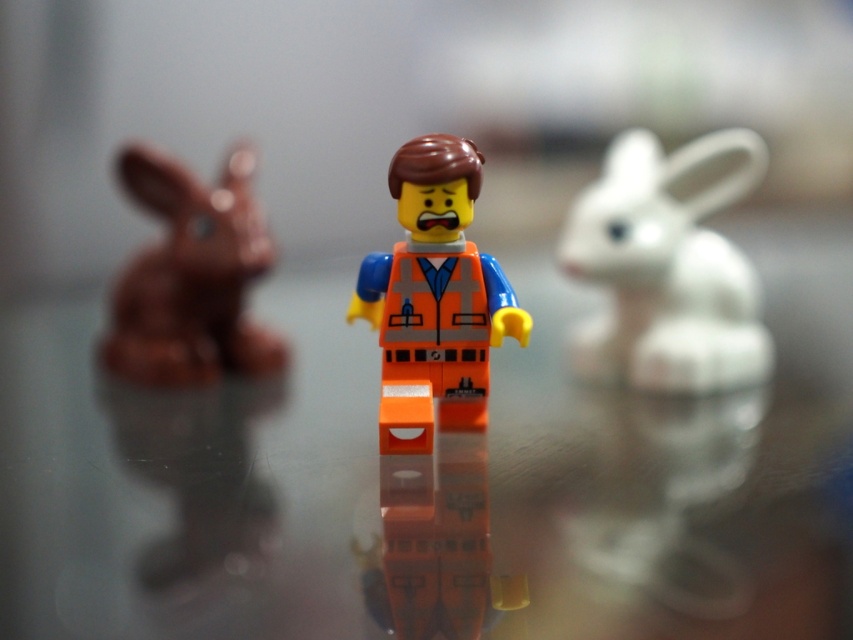
Which is below, white matte rabbit at right or matte brown bunny at left?

matte brown bunny at left is lower down.

Who is higher up, white matte rabbit at right or matte brown bunny at left?

white matte rabbit at right is higher up.

This screenshot has height=640, width=853. Find the location of `white matte rabbit at right`. white matte rabbit at right is located at coordinates (668, 268).

Describe the element at coordinates (434, 298) in the screenshot. I see `orange matte/soft plastic minifigure at center` at that location.

Does orange matte/soft plastic minifigure at center have a lesser width compared to matte brown bunny at left?

Indeed, orange matte/soft plastic minifigure at center has a lesser width compared to matte brown bunny at left.

Between point (488, 324) and point (190, 266), which one is positioned behind?

The point (190, 266) is more distant.

You are a GUI agent. You are given a task and a screenshot of the screen. Output one action in this format:
    pyautogui.click(x=<x>, y=<y>)
    Task: Click on the orange matte/soft plastic minifigure at center
    The image size is (853, 640).
    Given the screenshot: What is the action you would take?
    pyautogui.click(x=434, y=298)

Based on the photo, does white matte rabbit at right have a greater width compared to orange matte/soft plastic minifigure at center?

Yes, white matte rabbit at right is wider than orange matte/soft plastic minifigure at center.

Which is behind, point (697, 340) or point (409, 369)?

Positioned behind is point (697, 340).

Where is `white matte rabbit at right`? This screenshot has height=640, width=853. white matte rabbit at right is located at coordinates (668, 268).